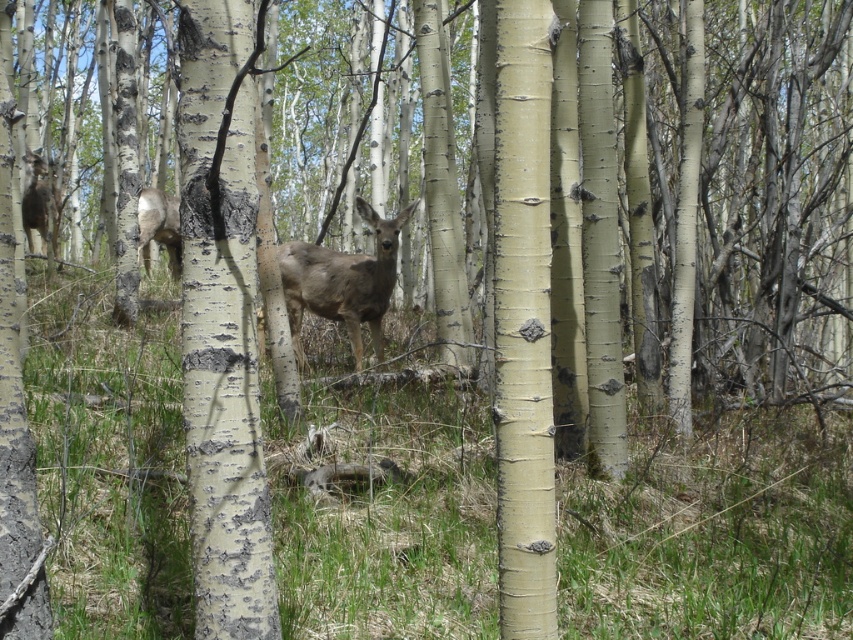
Question: Which point appears closest to the camera in this image?

Choices:
 (A) (364, 205)
 (B) (32, 182)

Answer: (A)

Question: Does brown matte deer at center appear under brown fur deer at left?

Choices:
 (A) no
 (B) yes

Answer: (B)

Question: Is brown fur deer at center bigger than brown matte deer at center?

Choices:
 (A) no
 (B) yes

Answer: (B)

Question: Which of the following is the closest to the observer?

Choices:
 (A) brown matte deer at center
 (B) brown fur deer at left

Answer: (A)

Question: Which point is closer to the camera taking this photo?

Choices:
 (A) [45, 186]
 (B) [370, 284]

Answer: (B)

Question: Is brown matte deer at center to the right of brown fur deer at left from the viewer's perspective?

Choices:
 (A) no
 (B) yes

Answer: (B)